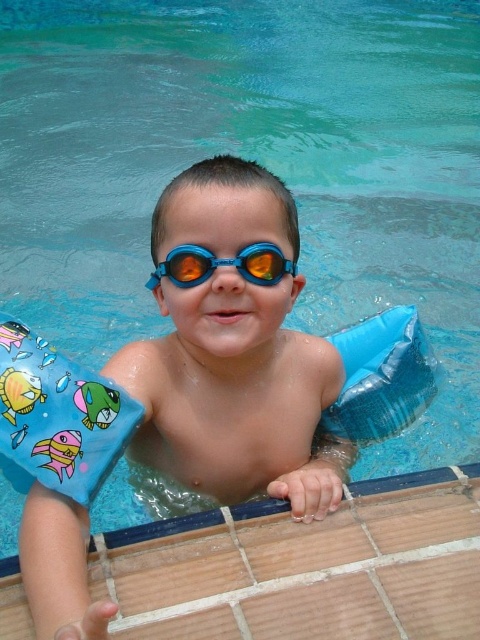
Does blue rubber arm float at center have a larger size compared to blue rubber goggles at center?

Correct, blue rubber arm float at center is larger in size than blue rubber goggles at center.

Locate an element on the screen. The width and height of the screenshot is (480, 640). blue rubber arm float at center is located at coordinates [236, 396].